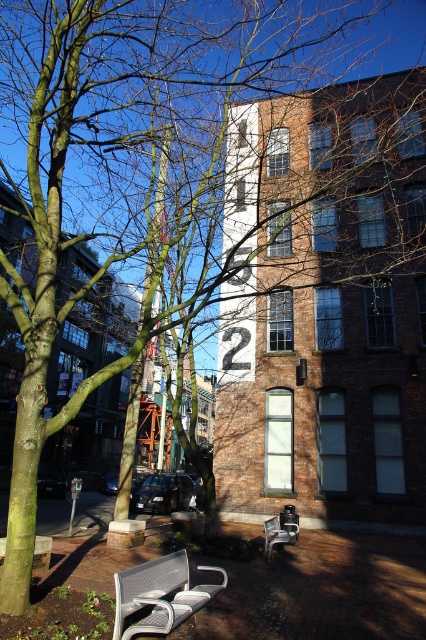
Is metallic mesh bench at lower center below metallic silver bench at center?

No, metallic mesh bench at lower center is not below metallic silver bench at center.

Does metallic mesh bench at lower center lie behind metallic silver bench at center?

That is False.

What do you see at coordinates (160, 595) in the screenshot? Image resolution: width=426 pixels, height=640 pixels. I see `metallic mesh bench at lower center` at bounding box center [160, 595].

Identify the location of metallic mesh bench at lower center. This screenshot has width=426, height=640. (160, 595).

Consider the image. Does metallic mesh bench at lower center have a lesser width compared to metallic silver bench at lower left?

No, metallic mesh bench at lower center is not thinner than metallic silver bench at lower left.

Who is positioned more to the right, metallic mesh bench at lower center or metallic silver bench at lower left?

From the viewer's perspective, metallic mesh bench at lower center appears more on the right side.

Find the location of a particular element. The image size is (426, 640). metallic mesh bench at lower center is located at coordinates (160, 595).

Is metallic silver bench at center below metallic silver bench at lower left?

Correct, metallic silver bench at center is located below metallic silver bench at lower left.

In the scene shown: Does metallic silver bench at center have a larger size compared to metallic silver bench at lower left?

Correct, metallic silver bench at center is larger in size than metallic silver bench at lower left.

What do you see at coordinates (279, 532) in the screenshot?
I see `metallic silver bench at center` at bounding box center [279, 532].

At what (x,y) coordinates should I click in order to perform the action: click on metallic silver bench at center. Please return your answer as a coordinate pair (x, y). Image resolution: width=426 pixels, height=640 pixels. Looking at the image, I should click on (279, 532).